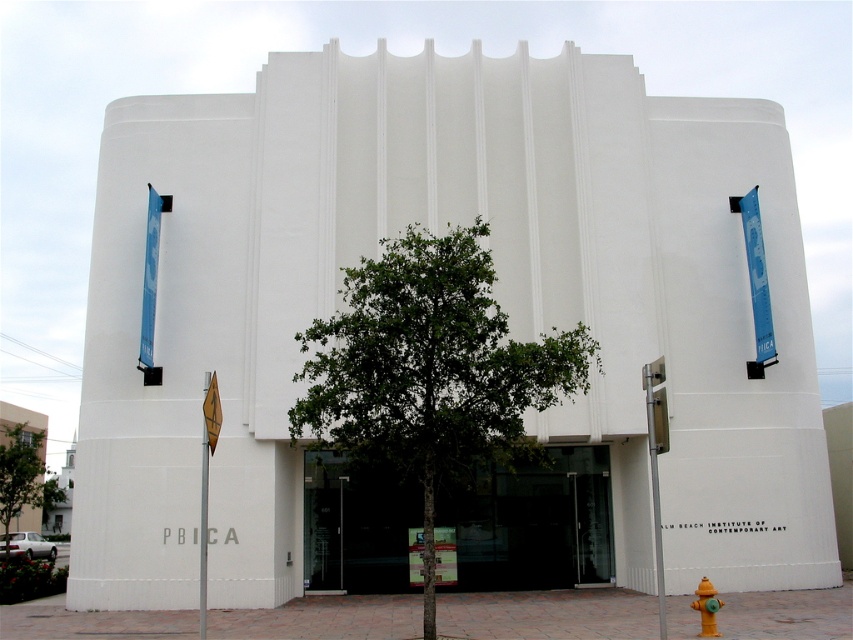
You are standing at the entrance of the modern building and want to find the point marked at coordinates (x=19, y=474). According to the image, where is this point located?

The point marked at coordinates (x=19, y=474) is located on the green leafy tree at left.

You are standing in front of the modern building and want to locate two specific points marked on the image. The first point is at coordinates point (558, 394) and the second is at point (27, 449). Which of these points is closer to you?

Point (558, 394) is closer to the viewer than point (27, 449).

You are a visitor approaching the entrance of the modern building and want to locate both the green leafy tree at left and the yellow matte hydrant at lower right. Which object will you see first as you walk towards the building?

The green leafy tree at left will be seen first because it is closer to the viewer compared to the yellow matte hydrant at lower right, which is positioned further back.